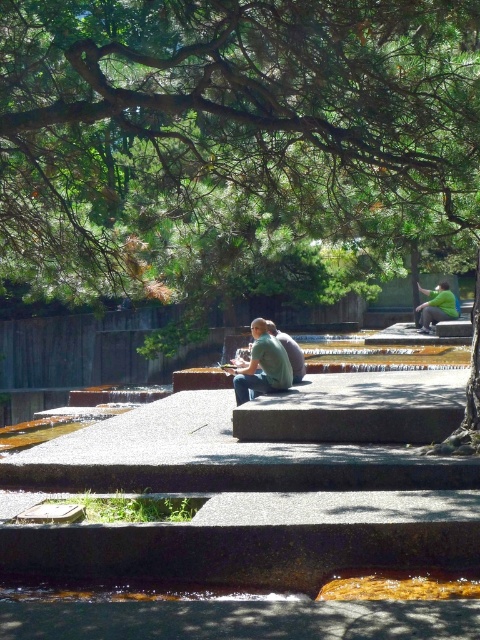
You are standing at the bottom of the steps near the waterfall. Looking up, you see the green leafy tree at upper center and the green cotton shirt at center. Which object is higher from your viewpoint?

The green leafy tree at upper center is higher than the green cotton shirt at center from your viewpoint.

You are standing in the park and want to take a photo of the green leafy tree at upper center. Your camera has a maximum focus range of 5 meters. Will you be able to capture the tree clearly without moving closer?

The green leafy tree at upper center is 5.60 meters away from you. Since your camera can only focus up to 5 meters, you will need to move closer to ensure the tree is in clear focus.

You are standing at the bottom of the steps near the waterfall and want to take a photo of the green leafy tree at upper center and the green cotton shirt at center. Which object should you focus on first if you want to include both in your photo without moving the camera?

A: You should focus on the green leafy tree at upper center first because it is wider than the green cotton shirt at center, so capturing its full width will ensure both are in frame.